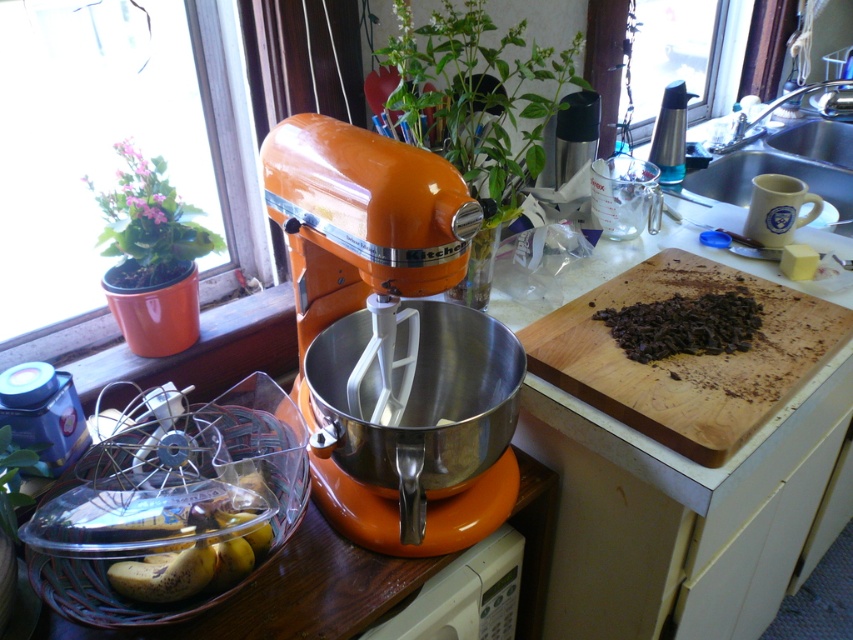
Is orange glossy kitchenaid mixer at center to the right of yellow matte bananas at lower left from the viewer's perspective?

Yes, orange glossy kitchenaid mixer at center is to the right of yellow matte bananas at lower left.

Based on the photo, can you confirm if orange glossy kitchenaid mixer at center is taller than yellow matte bananas at lower left?

Indeed, orange glossy kitchenaid mixer at center has a greater height compared to yellow matte bananas at lower left.

The image size is (853, 640). In order to click on orange glossy kitchenaid mixer at center in this screenshot , I will do `click(392, 339)`.

Can you confirm if orange plastic counter at center is smaller than dark chocolate chunks at center?

No.

Is point (743, 522) closer to camera compared to point (735, 344)?

No, (743, 522) is further to viewer.

The image size is (853, 640). Describe the element at coordinates (683, 515) in the screenshot. I see `orange plastic counter at center` at that location.

The width and height of the screenshot is (853, 640). Identify the location of orange plastic counter at center. (683, 515).

Which is behind, point (740, 611) or point (12, 420)?

Point (740, 611)

In the scene shown: Does orange plastic counter at center have a lesser height compared to matte black canister at left?

Incorrect, orange plastic counter at center's height does not fall short of matte black canister at left's.

Measure the distance between orange plastic counter at center and camera.

orange plastic counter at center and camera are 32.99 inches apart.

Find the location of a particular element. orange plastic counter at center is located at coordinates (683, 515).